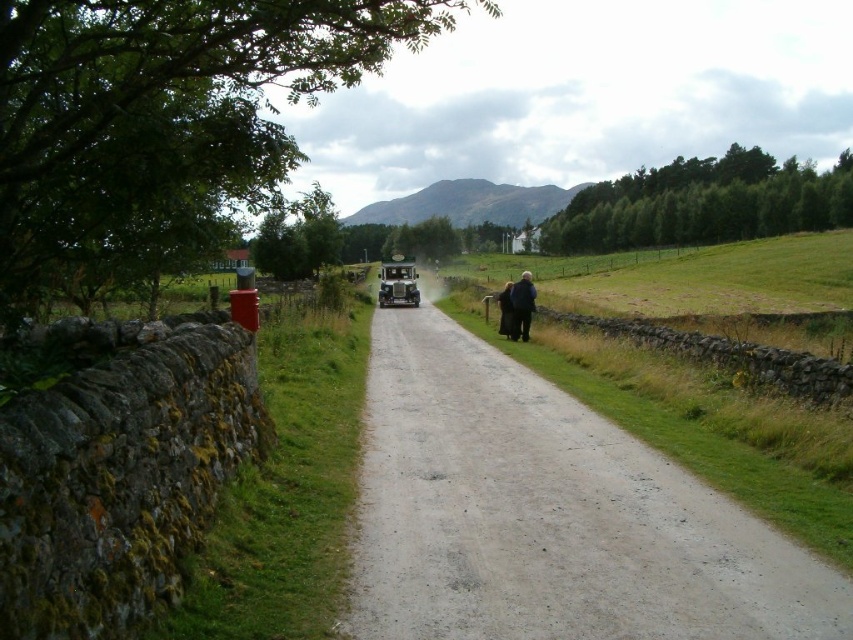
Question: Is the position of dusty gravel road at center less distant than that of black wool coat at right?

Choices:
 (A) yes
 (B) no

Answer: (A)

Question: Among these points, which one is farthest from the camera?

Choices:
 (A) (364, 518)
 (B) (515, 323)
 (C) (498, 292)

Answer: (C)

Question: Is dusty gravel road at center above dark brown wool coat at right?

Choices:
 (A) yes
 (B) no

Answer: (B)

Question: Is black wool coat at right positioned at the back of dark brown wool coat at right?

Choices:
 (A) no
 (B) yes

Answer: (A)

Question: Which of the following is the farthest from the observer?

Choices:
 (A) dark brown wool coat at right
 (B) black wool coat at right
 (C) dusty gravel road at center

Answer: (A)

Question: Which of the following is the farthest from the observer?

Choices:
 (A) (508, 326)
 (B) (524, 340)
 (C) (782, 604)

Answer: (A)